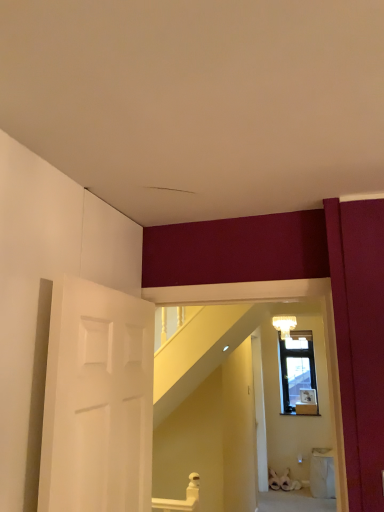
Question: Considering the positions of white matte door at center and white frosted glass light fixture at upper center in the image, is white matte door at center bigger or smaller than white frosted glass light fixture at upper center?

Choices:
 (A) big
 (B) small

Answer: (A)

Question: Considering the positions of white matte door at center and white frosted glass light fixture at upper center in the image, is white matte door at center taller or shorter than white frosted glass light fixture at upper center?

Choices:
 (A) tall
 (B) short

Answer: (A)

Question: Considering their positions, is white matte door at center located in front of or behind white frosted glass light fixture at upper center?

Choices:
 (A) front
 (B) behind

Answer: (A)

Question: From a real-world perspective, is white frosted glass light fixture at upper center physically located above or below white matte door at center?

Choices:
 (A) above
 (B) below

Answer: (A)

Question: Based on their sizes in the image, would you say white frosted glass light fixture at upper center is bigger or smaller than white matte door at center?

Choices:
 (A) big
 (B) small

Answer: (B)

Question: In the image, is white frosted glass light fixture at upper center positioned in front of or behind white matte door at center?

Choices:
 (A) front
 (B) behind

Answer: (B)

Question: Does point (289, 325) appear closer or farther from the camera than point (261, 455)?

Choices:
 (A) closer
 (B) farther

Answer: (B)